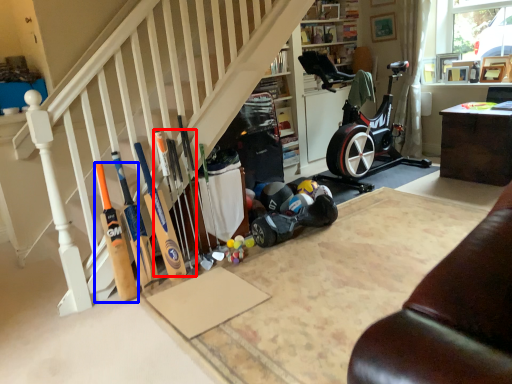
Question: Which object is closer to the camera taking this photo, baseball bat (highlighted by a red box) or baseball bat (highlighted by a blue box)?

Choices:
 (A) baseball bat
 (B) baseball bat

Answer: (B)